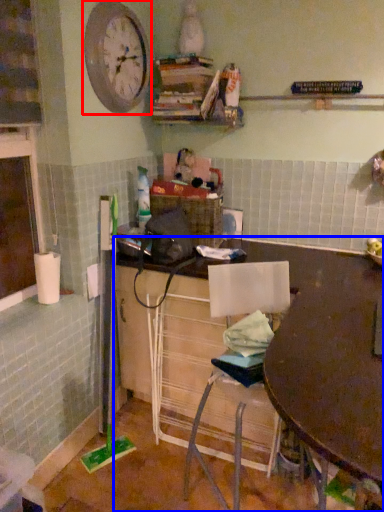
Question: Which object is closer to the camera taking this photo, clock (highlighted by a red box) or desk (highlighted by a blue box)?

Choices:
 (A) clock
 (B) desk

Answer: (B)